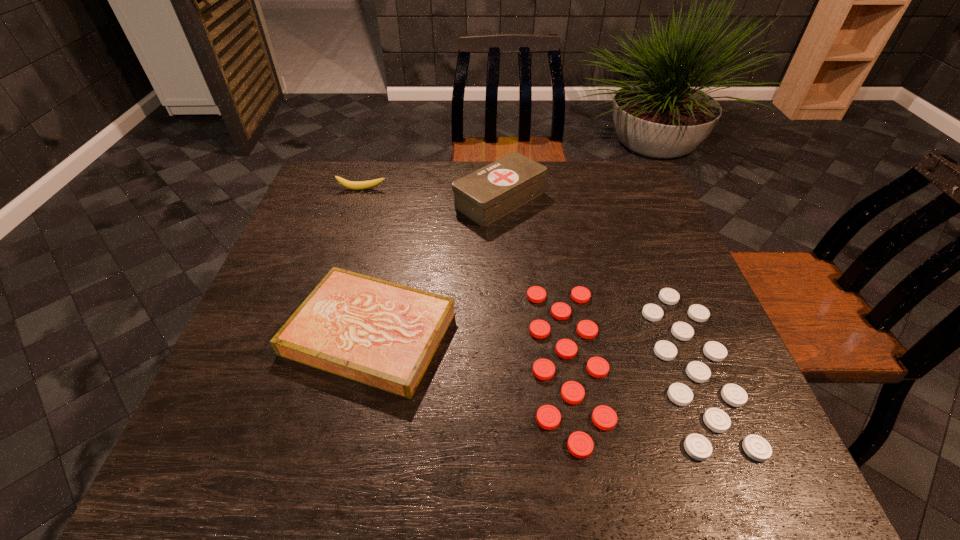
Where is `unoccupied area between the banana and the hardback book`? unoccupied area between the banana and the hardback book is located at coordinates (366, 261).

Where is `free spot between the first-aid kit and the hardback book`? The image size is (960, 540). free spot between the first-aid kit and the hardback book is located at coordinates (435, 266).

Locate which object ranks third in proximity to the checkerboard. Please provide its 2D coordinates. Your answer should be formatted as a tuple, i.e. [(x, y)], where the tuple contains the x and y coordinates of a point satisfying the conditions above.

[(354, 185)]

Locate an element on the screen. The width and height of the screenshot is (960, 540). object that ranks as the second closest to the checkerboard is located at coordinates (485, 195).

At what (x,y) coordinates should I click in order to perform the action: click on vacant point that satisfies the following two spatial constraints: 1. on the front side of the checkerboard; 2. on the right side of the tallest object. Please return your answer as a coordinate pair (x, y). Looking at the image, I should click on (509, 362).

At what (x,y) coordinates should I click in order to perform the action: click on vacant position in the image that satisfies the following two spatial constraints: 1. on the upward curve of the checkerboard; 2. on the left side of the banana. Please return your answer as a coordinate pair (x, y). This screenshot has width=960, height=540. Looking at the image, I should click on (304, 362).

Where is `vacant space that satisfies the following two spatial constraints: 1. on the back side of the hardback book; 2. on the left side of the tallest object`? vacant space that satisfies the following two spatial constraints: 1. on the back side of the hardback book; 2. on the left side of the tallest object is located at coordinates [399, 199].

Where is `free space that satisfies the following two spatial constraints: 1. on the front side of the shortest object; 2. on the right side of the tallest object`? Image resolution: width=960 pixels, height=540 pixels. free space that satisfies the following two spatial constraints: 1. on the front side of the shortest object; 2. on the right side of the tallest object is located at coordinates (509, 362).

This screenshot has width=960, height=540. In order to click on free space that satisfies the following two spatial constraints: 1. on the upward curve of the tallest object; 2. on the left side of the banana in this screenshot , I will do `click(358, 199)`.

Locate an element on the screen. The image size is (960, 540). vacant space that satisfies the following two spatial constraints: 1. on the upward curve of the banana; 2. on the right side of the tallest object is located at coordinates pos(358,199).